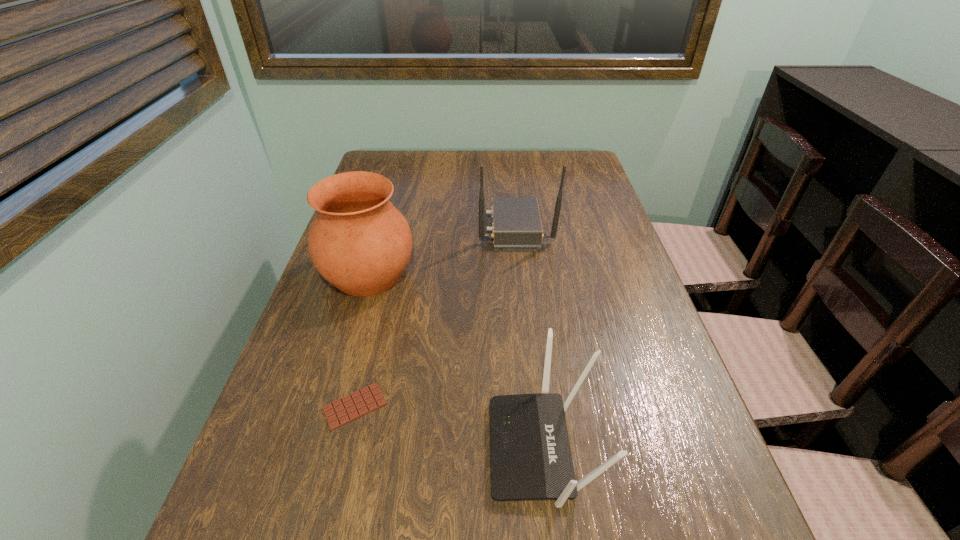
Find the location of a particular element. Image resolution: width=960 pixels, height=540 pixels. vacant region located 0.370m on the front-facing side of the nearer router is located at coordinates (266, 448).

Locate an element on the screen. The height and width of the screenshot is (540, 960). free location located 0.300m on the front-facing side of the nearer router is located at coordinates (308, 448).

Identify the location of vacant space located 0.050m on the right of the candy bar. (416, 406).

At what (x,y) coordinates should I click in order to perform the action: click on pottery that is at the left edge. Please return your answer as a coordinate pair (x, y). Looking at the image, I should click on (359, 242).

This screenshot has height=540, width=960. I want to click on candy bar situated at the left edge, so click(355, 405).

In the image, there is a desktop. Where is `vacant space at the far edge`? This screenshot has width=960, height=540. vacant space at the far edge is located at coordinates (451, 151).

This screenshot has height=540, width=960. I want to click on vacant area at the left edge of the desktop, so click(x=252, y=447).

This screenshot has height=540, width=960. I want to click on free space at the right edge of the desktop, so click(583, 297).

Where is `vacant position at the far right corner of the desktop`? vacant position at the far right corner of the desktop is located at coordinates (599, 180).

Identify the location of free area in between the shortest object and the nearer router. (449, 427).